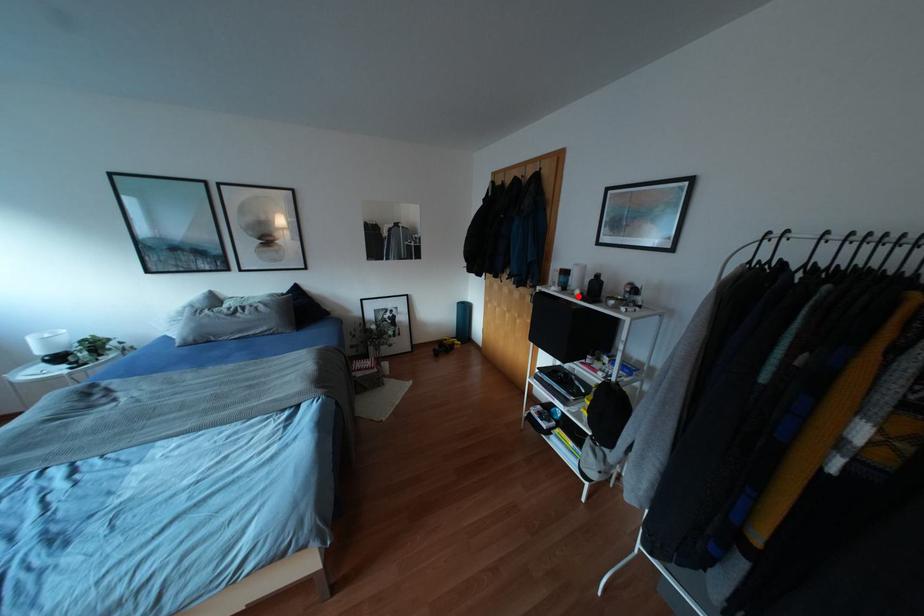
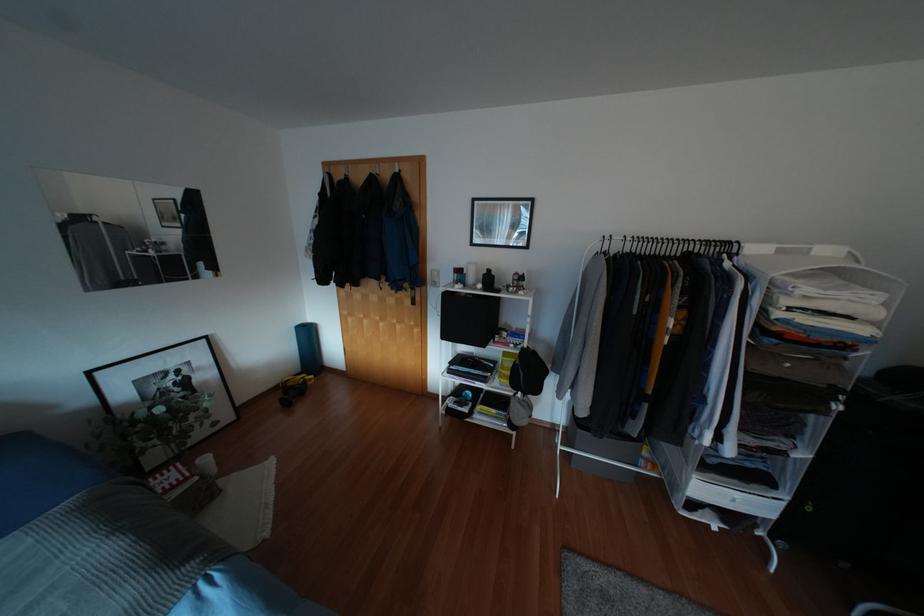
Where in the second image is the point corresponding to the highlighted location from the first image?

(483, 289)